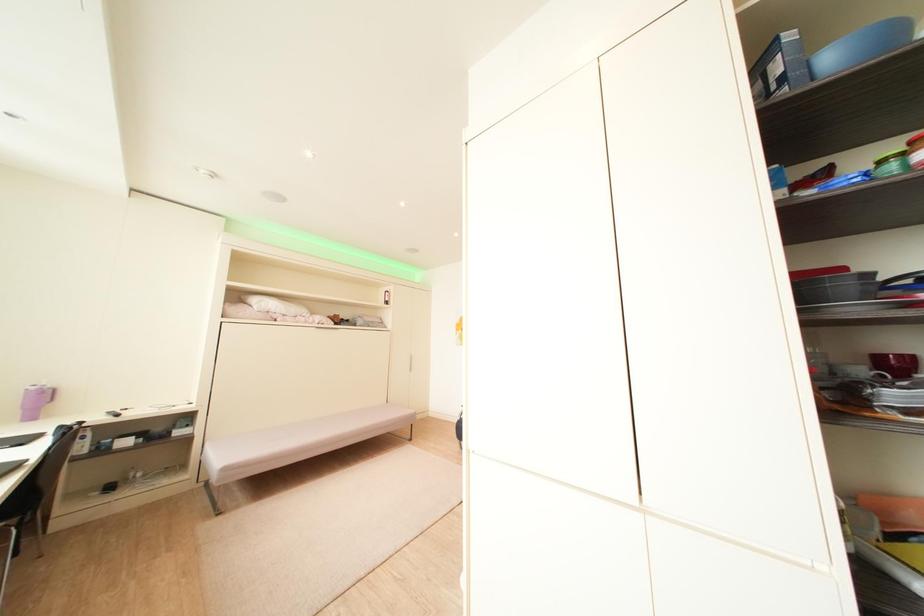
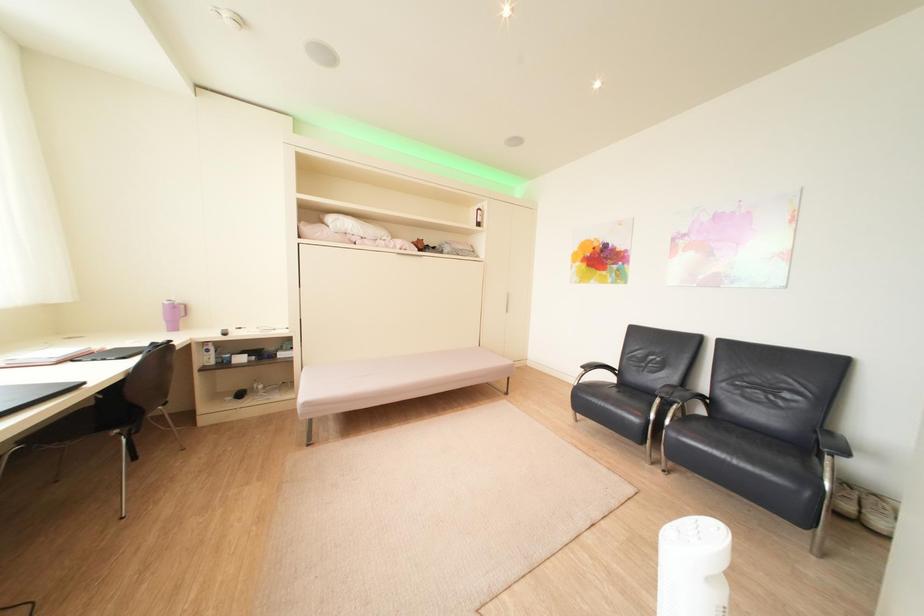
Question: Which direction would the cameraman need to move to produce the second image? Reply with the corresponding letter.

Choices:
 (A) Left
 (B) Right
 (C) Forward
 (D) Backward

Answer: (C)